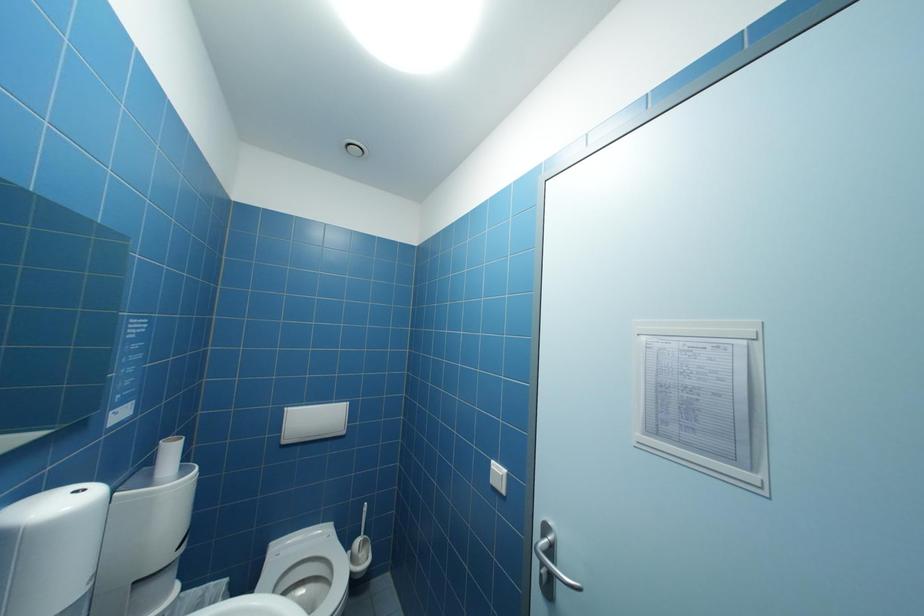
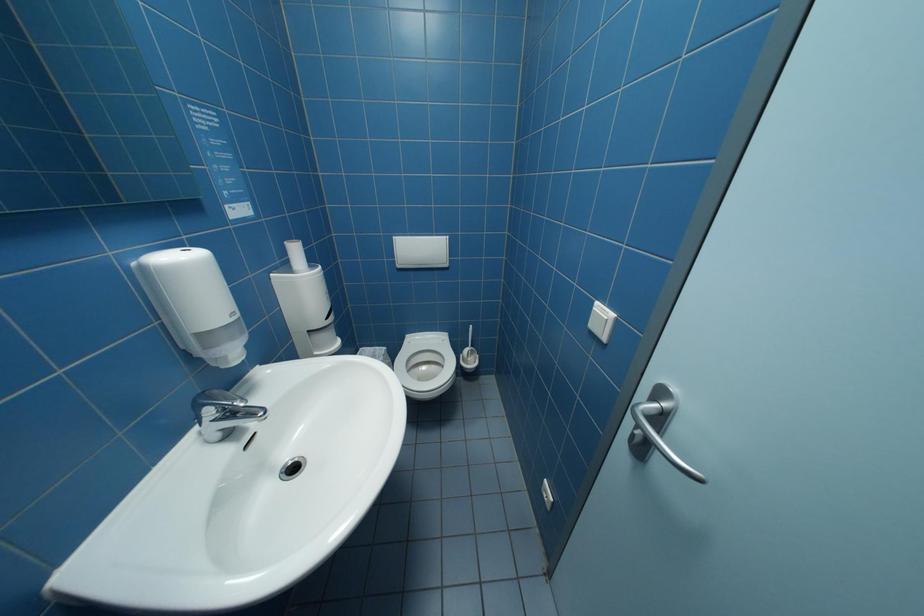
In the scene shown: The first image is from the beginning of the video and the second image is from the end. How did the camera likely rotate when shooting the video?

The rotation direction of the camera is left-down.